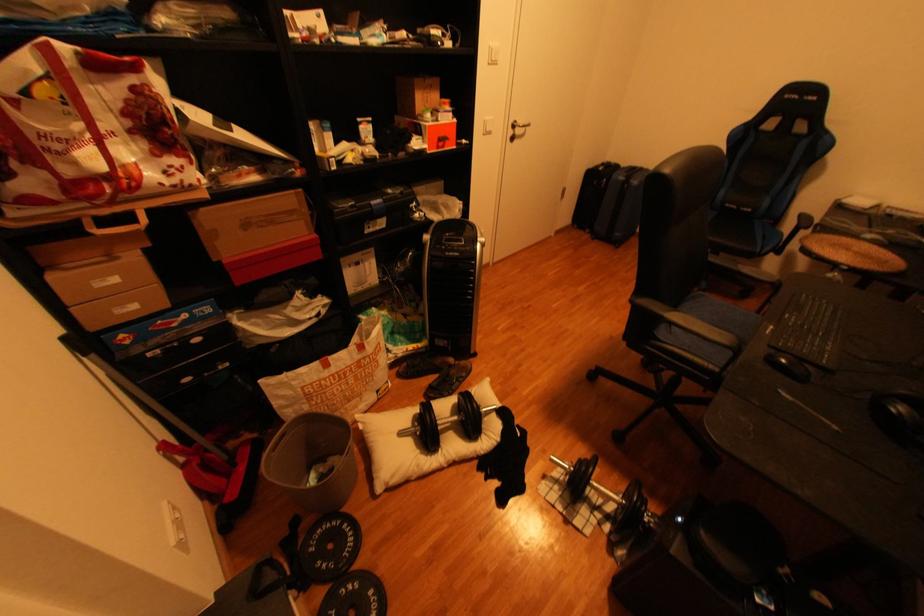
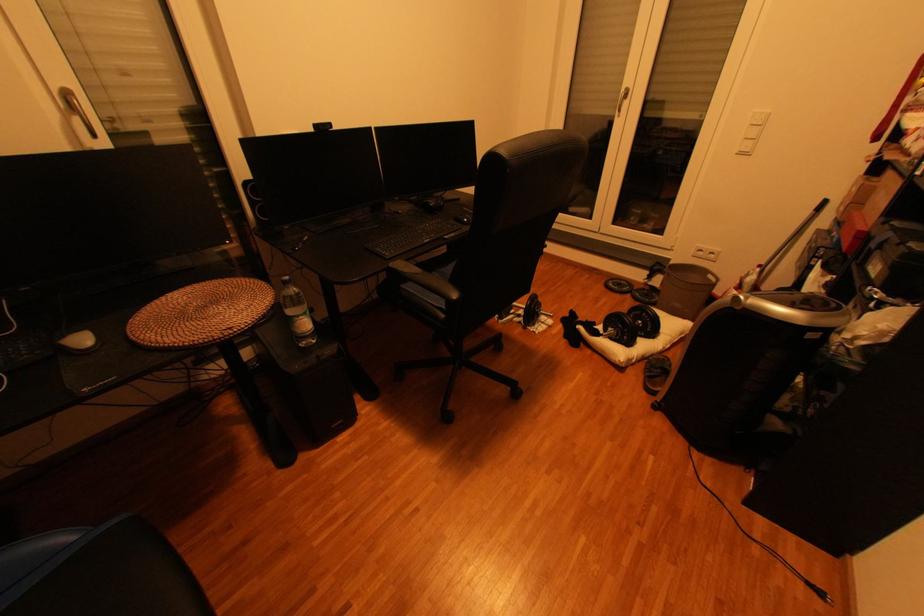
Find the pixel in the second image that matches point (354, 527) in the first image.

(658, 301)